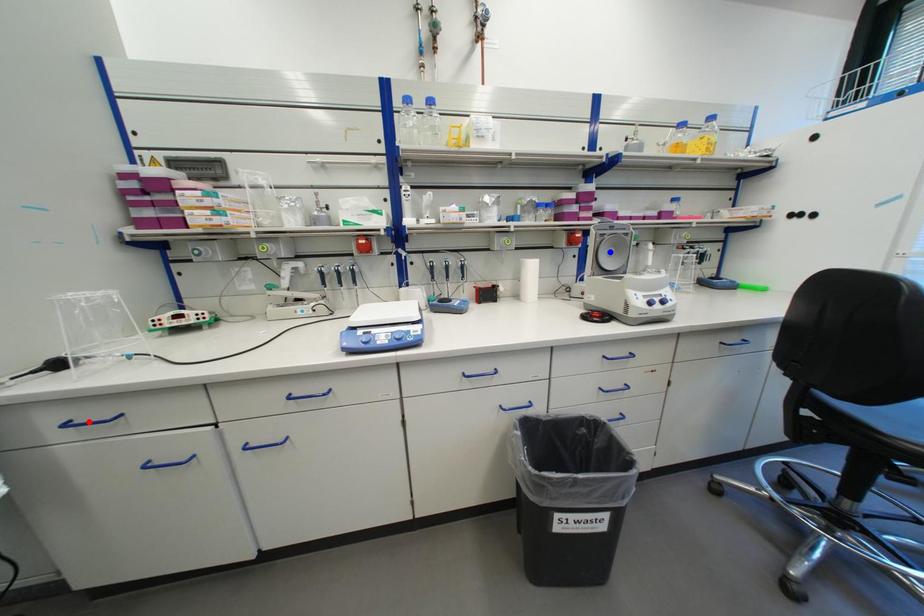
Question: Two points are marked on the image. Which point is closer to the camera?

Choices:
 (A) Blue point is closer.
 (B) Red point is closer.

Answer: (B)